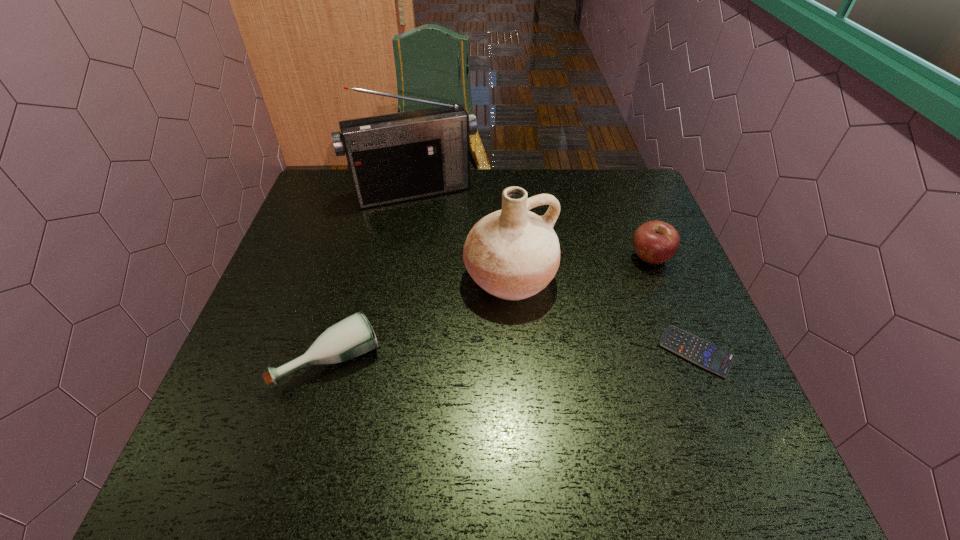
Where is `blank region between the bottle and the apple`? The height and width of the screenshot is (540, 960). blank region between the bottle and the apple is located at coordinates (491, 308).

Identify which object is the closest to the second tallest object. Please provide its 2D coordinates. Your answer should be formatted as a tuple, i.e. [(x, y)], where the tuple contains the x and y coordinates of a point satisfying the conditions above.

[(396, 157)]

Locate an element on the screen. This screenshot has height=540, width=960. object that stands as the third closest to the radio receiver is located at coordinates (353, 336).

The height and width of the screenshot is (540, 960). Identify the location of vacant space that satisfies the following two spatial constraints: 1. on the front side of the radio receiver; 2. on the left side of the calculator. (386, 352).

This screenshot has height=540, width=960. I want to click on vacant space that satisfies the following two spatial constraints: 1. on the back side of the apple; 2. on the right side of the pottery, so click(509, 257).

Find the location of `free space that satisfies the following two spatial constraints: 1. on the front side of the radio receiver; 2. on the right side of the fourth shortest object`. free space that satisfies the following two spatial constraints: 1. on the front side of the radio receiver; 2. on the right side of the fourth shortest object is located at coordinates (398, 278).

Image resolution: width=960 pixels, height=540 pixels. Identify the location of vacant space that satisfies the following two spatial constraints: 1. on the front side of the radio receiver; 2. on the right side of the fourth shortest object. (398, 278).

The image size is (960, 540). In order to click on free space that satisfies the following two spatial constraints: 1. on the front side of the tallest object; 2. on the right side of the fourth shortest object in this screenshot , I will do click(x=398, y=278).